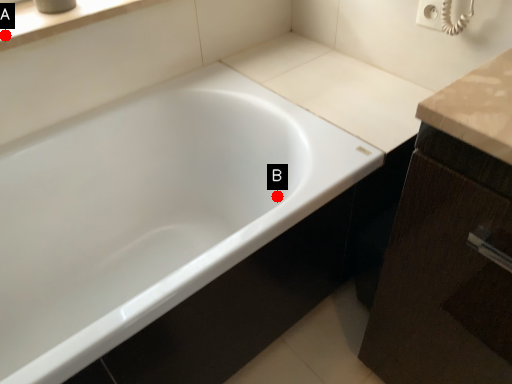
Question: Two points are circled on the image, labeled by A and B beside each circle. Among these points, which one is nearest to the camera?

Choices:
 (A) A is closer
 (B) B is closer

Answer: (A)